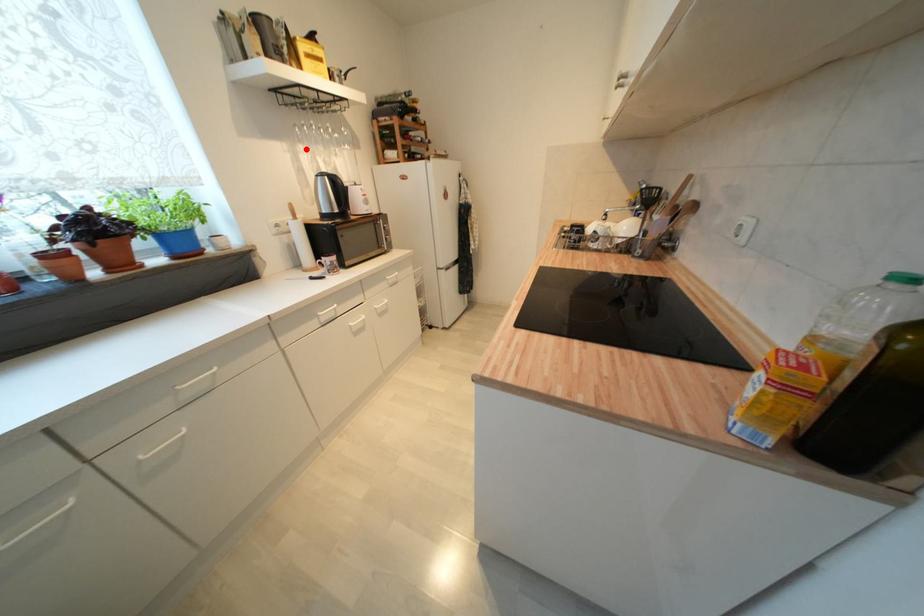
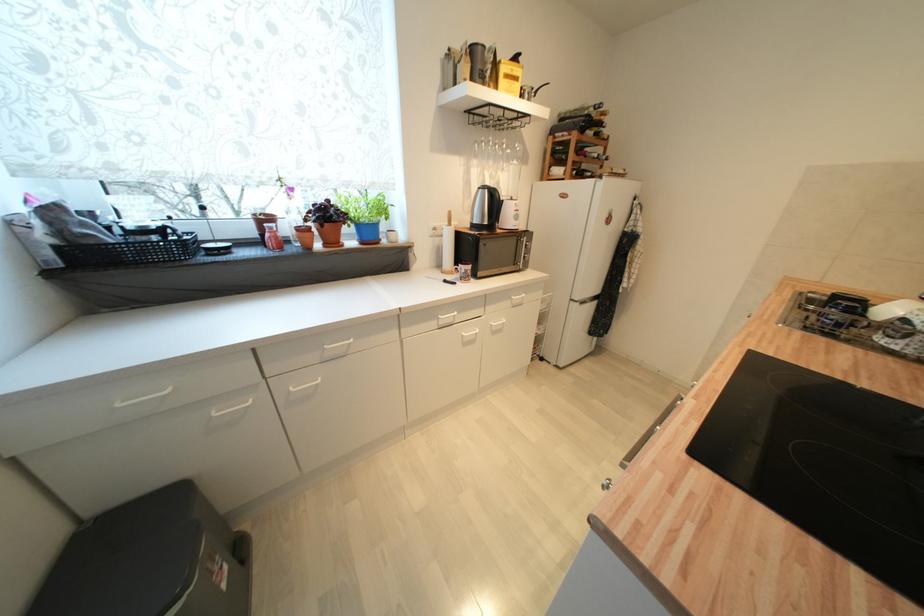
Locate, in the second image, the point that corresponds to the highlighted location in the first image.

(480, 164)